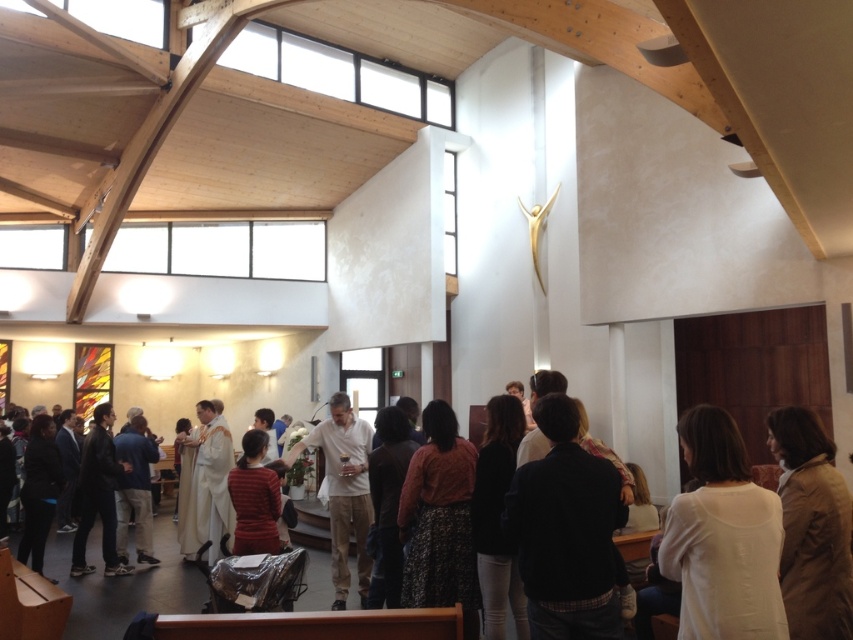
Does dark blue sweater at center have a greater height compared to light beige cotton shirt at center?

No, dark blue sweater at center is not taller than light beige cotton shirt at center.

Based on the photo, is dark blue sweater at center shorter than light beige cotton shirt at center?

Yes.

I want to click on dark blue sweater at center, so click(x=566, y=531).

Between point (347, 452) and point (213, 452), which one is positioned in front?

Point (347, 452)

Is light beige cotton shirt at center thinner than white clothed person at lower left?

Yes, light beige cotton shirt at center is thinner than white clothed person at lower left.

Which is behind, point (358, 586) or point (210, 467)?

The point (210, 467) is behind.

This screenshot has width=853, height=640. Find the location of `light beige cotton shirt at center`. light beige cotton shirt at center is located at coordinates (343, 490).

Which of these two, white matte shirt at center or white clothed person at lower left, stands taller?

With more height is white clothed person at lower left.

Is white matte shirt at center positioned in front of white clothed person at lower left?

That is True.

This screenshot has width=853, height=640. Identify the location of white matte shirt at center. [722, 538].